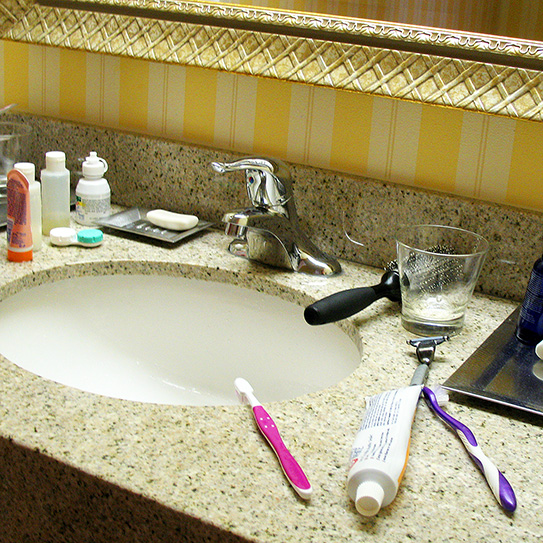
I want to click on soap dish, so click(147, 231).